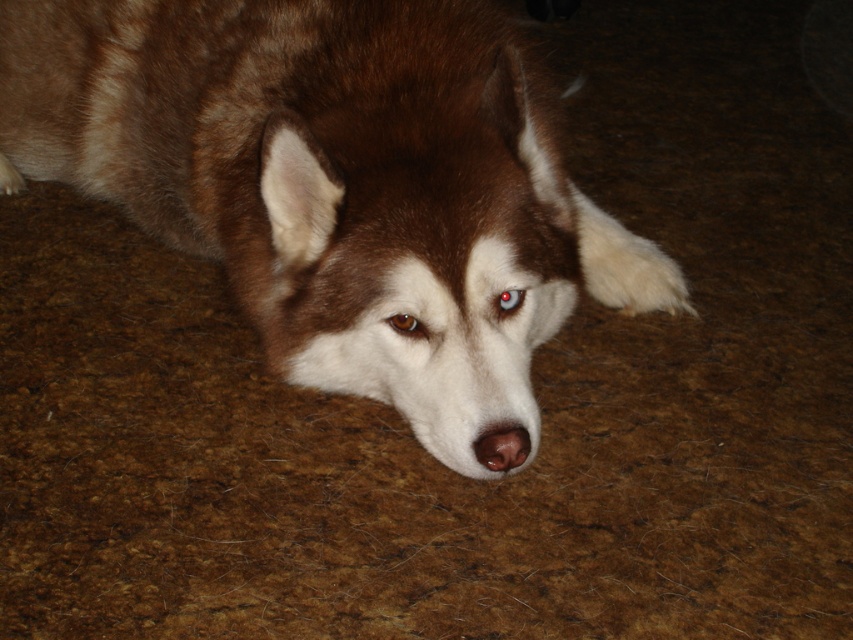
You are taking a photo of a dog and notice two points marked on the image. The points are labeled as point (512,422) and point (403,333). Based on the scene, which point is closer to the camera?

Point (512,422) is closer to the camera than point (403,333).

Consider the image. You are a photographer adjusting the focus on your camera. You have two points in the image to focus on, point (387,237) and point (503,305). Which point is closer to your camera?

Point (387,237) is closer to the camera than point (503,305).